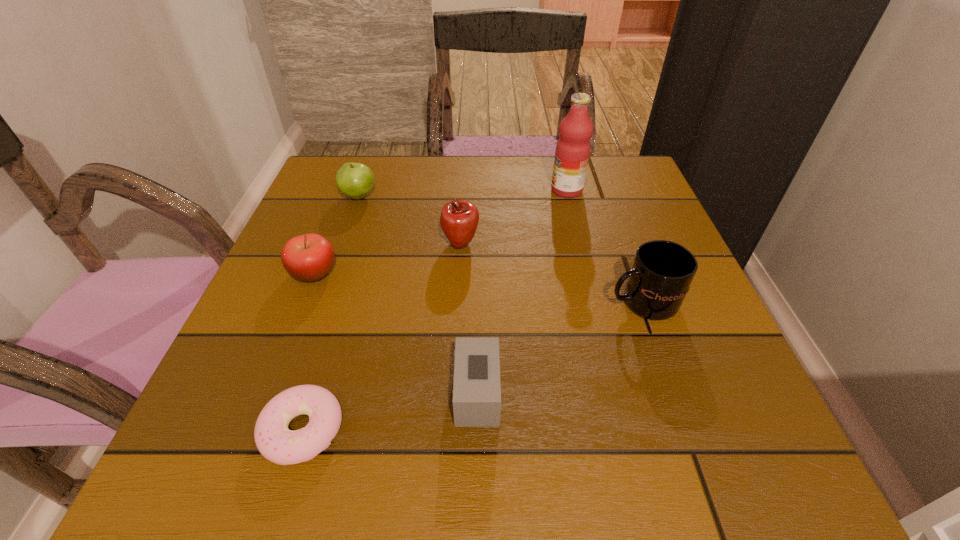
Where is `doughnut positioned at the left edge`? doughnut positioned at the left edge is located at coordinates (274, 440).

Find the location of a particular element. The width and height of the screenshot is (960, 540). fruit juice that is positioned at the right edge is located at coordinates (572, 152).

Locate an element on the screen. The image size is (960, 540). mug present at the right edge is located at coordinates (662, 271).

Locate an element on the screen. The height and width of the screenshot is (540, 960). object located in the far left corner section of the desktop is located at coordinates [x=355, y=180].

What are the coordinates of `object that is at the near left corner` in the screenshot? It's located at (274, 440).

You are a GUI agent. You are given a task and a screenshot of the screen. Output one action in this format:
    pyautogui.click(x=<x>, y=<y>)
    Task: Click on the object present at the far right corner
    This screenshot has height=540, width=960.
    Given the screenshot: What is the action you would take?
    pyautogui.click(x=572, y=152)

In the image, there is a desktop. Where is `vacant space at the far edge`? vacant space at the far edge is located at coordinates (497, 183).

The height and width of the screenshot is (540, 960). In the image, there is a desktop. Identify the location of vacant space at the near edge. (649, 483).

Locate an element on the screen. free space at the left edge is located at coordinates (324, 230).

In the image, there is a desktop. Find the location of `vacant area at the right edge`. vacant area at the right edge is located at coordinates (729, 359).